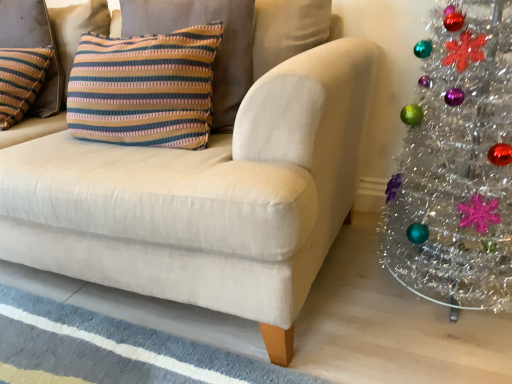
Question: In terms of width, does matte beige couch at center look wider or thinner when compared to striped fabric pillow at upper left, which is the 2th pillow in left-to-right order?

Choices:
 (A) wide
 (B) thin

Answer: (A)

Question: In the image, is matte beige couch at center on the left side or the right side of striped fabric pillow at upper left, which is the 2th pillow in left-to-right order?

Choices:
 (A) left
 (B) right

Answer: (A)

Question: Estimate the real-world distances between objects in this image. Which object is closer to the matte beige couch at center?

Choices:
 (A) shiny silver christmas tree at right
 (B) striped fabric pillow at upper left, which is the first pillow in right-to-left order
 (C) knitted striped pillow at upper left, positioned as the second pillow in right-to-left order

Answer: (B)

Question: Considering the real-world distances, which object is closest to the shiny silver christmas tree at right?

Choices:
 (A) knitted striped pillow at upper left, which ranks as the first pillow in left-to-right order
 (B) matte beige couch at center
 (C) striped fabric pillow at upper left, which is the first pillow in right-to-left order

Answer: (B)